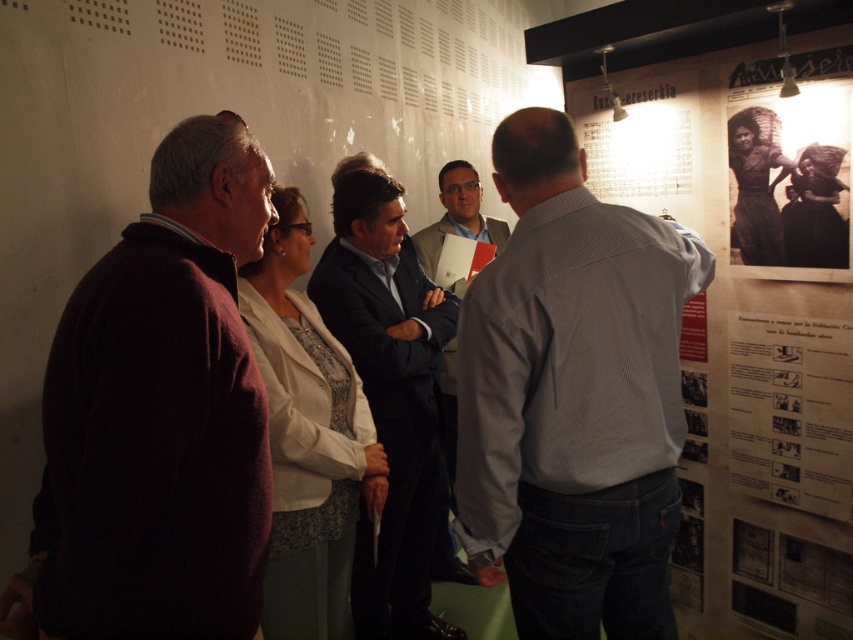
Is wooden signboard at center wider than light brown leather jacket at center?

Incorrect, wooden signboard at center's width does not surpass light brown leather jacket at center's.

Is point (728, 394) closer to viewer compared to point (428, 248)?

Yes, it is in front of point (428, 248).

I want to click on wooden signboard at center, so click(791, 412).

Which is more to the right, wooden poster at right or light brown leather jacket at center?

wooden poster at right

Can you confirm if wooden poster at right is positioned above light brown leather jacket at center?

No, wooden poster at right is not above light brown leather jacket at center.

What do you see at coordinates (752, 317) in the screenshot? Image resolution: width=853 pixels, height=640 pixels. I see `wooden poster at right` at bounding box center [752, 317].

Locate an element on the screen. The height and width of the screenshot is (640, 853). wooden poster at right is located at coordinates (752, 317).

Can you confirm if maroon sweater at left is thinner than light brown leather jacket at center?

Yes.

Between maroon sweater at left and light brown leather jacket at center, which one is positioned higher?

Positioned higher is light brown leather jacket at center.

Between point (210, 497) and point (456, 454), which one is positioned in front?

Point (210, 497) is in front.

Identify the location of maroon sweater at left. (161, 412).